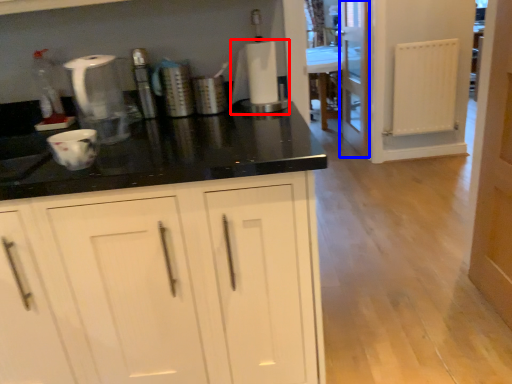
Question: Which point is further to the camera, appliance (highlighted by a red box) or screen door (highlighted by a blue box)?

Choices:
 (A) appliance
 (B) screen door

Answer: (B)